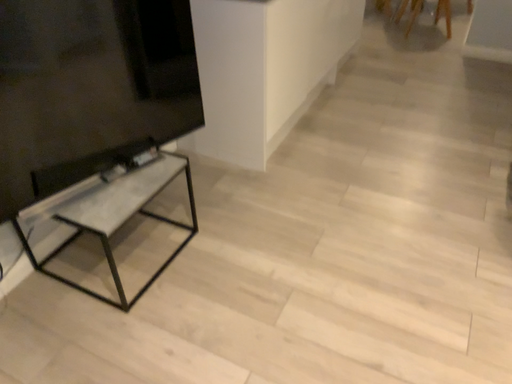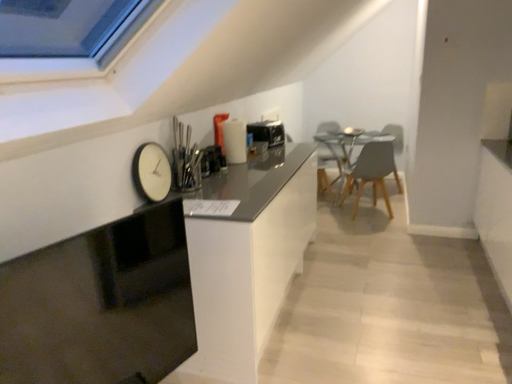
Question: Which way did the camera rotate in the video?

Choices:
 (A) rotated right
 (B) rotated left

Answer: (A)